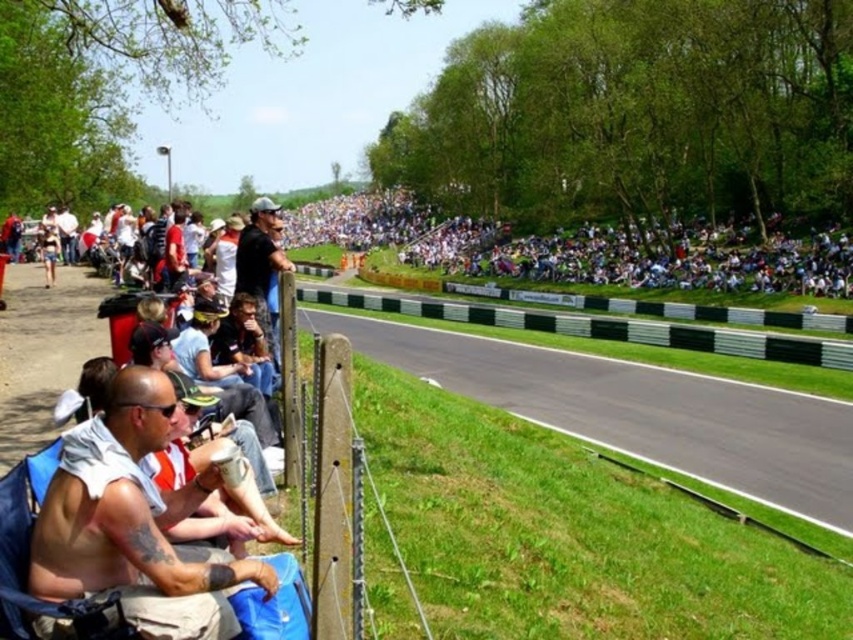
You are a photographer positioned at the origin point of the image. You need to capture a photo of the white cotton shirt at lower left. According to the coordinates provided, in which direction should you move your camera to frame the shirt properly?

The white cotton shirt at lower left is located at point (134, 522), which means it is positioned to the right and slightly downward from the center. To frame it properly, move your camera to the right and slightly downward.

You are a photographer standing at the edge of the track, and you want to take a photo that includes both the point at coordinates (688, 248) and the point at (422, 316). Given their positions, which point should be placed closer to the bottom edge of your photo frame?

Point (422, 316) should be placed closer to the bottom edge of the photo frame because it is closer to the camera than point (688, 248).

You are a photographer positioned at the edge of the track. You want to capture a photo of the white cotton shirt at center without the green plastic barrier at center appearing in the shot. Is this possible given their positions?

The white cotton shirt at center might be wider than green plastic barrier at center, so it is possible that the photographer can position themselves to capture the white cotton shirt at center without the green plastic barrier at center blocking the view.